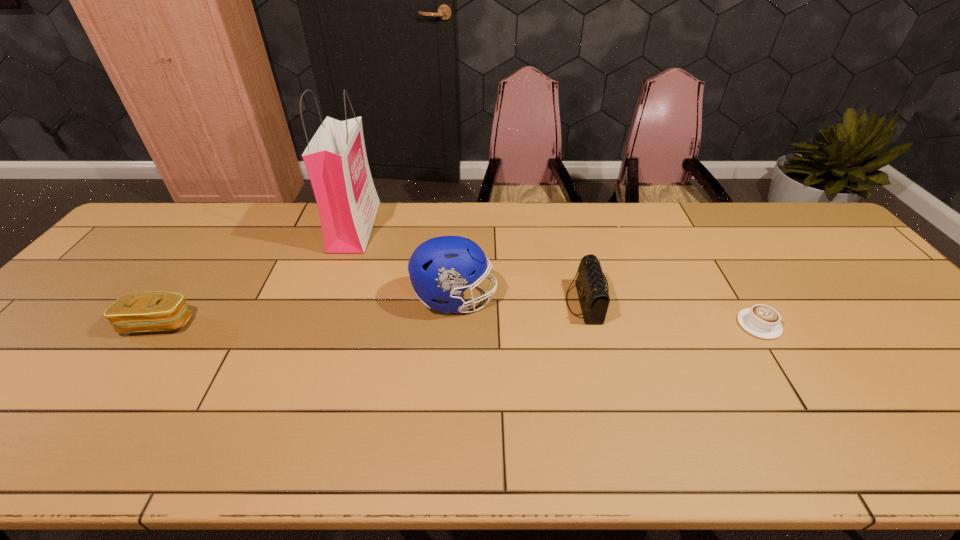
Find the location of a particular element. This screenshot has width=960, height=540. shopping bag is located at coordinates (336, 161).

Locate an element on the screen. Image resolution: width=960 pixels, height=540 pixels. the tallest object is located at coordinates point(336,161).

Find the location of `the fourth shortest object`. the fourth shortest object is located at coordinates (442, 268).

You are a GUI agent. You are given a task and a screenshot of the screen. Output one action in this format:
    pyautogui.click(x=<x>, y=<y>)
    Task: Click on the third object from left to right
    The width and height of the screenshot is (960, 540).
    Given the screenshot: What is the action you would take?
    pyautogui.click(x=442, y=268)

Where is `the third tallest object`? the third tallest object is located at coordinates (592, 287).

Where is `the taller clutch bag`? This screenshot has height=540, width=960. the taller clutch bag is located at coordinates (592, 287).

Find the location of a particular element. the left clutch bag is located at coordinates (155, 311).

Locate an element on the screen. the leftmost object is located at coordinates (155, 311).

Find the location of a particular element. This screenshot has height=540, width=960. the rightmost object is located at coordinates (762, 321).

What are the coordinates of `cappuccino` in the screenshot? It's located at (762, 321).